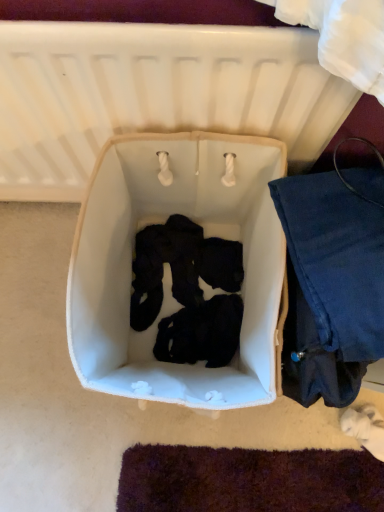
Question: Is white fabric infant bed at center located outside denim fabric pants at right?

Choices:
 (A) yes
 (B) no

Answer: (A)

Question: Is white fabric infant bed at center shorter than denim fabric pants at right?

Choices:
 (A) no
 (B) yes

Answer: (A)

Question: From a real-world perspective, is white fabric infant bed at center on denim fabric pants at right?

Choices:
 (A) yes
 (B) no

Answer: (A)

Question: Is white fabric infant bed at center to the right of denim fabric pants at right from the viewer's perspective?

Choices:
 (A) yes
 (B) no

Answer: (B)

Question: Can denim fabric pants at right be found inside white fabric infant bed at center?

Choices:
 (A) yes
 (B) no

Answer: (B)

Question: Relative to denim fabric pants at right, is white fabric infant bed at center in front or behind?

Choices:
 (A) front
 (B) behind

Answer: (A)

Question: Considering the positions of white fabric infant bed at center and denim fabric pants at right in the image, is white fabric infant bed at center wider or thinner than denim fabric pants at right?

Choices:
 (A) wide
 (B) thin

Answer: (B)

Question: In terms of size, does white fabric infant bed at center appear bigger or smaller than denim fabric pants at right?

Choices:
 (A) small
 (B) big

Answer: (A)

Question: Does point (44, 129) appear closer or farther from the camera than point (329, 230)?

Choices:
 (A) closer
 (B) farther

Answer: (B)

Question: In the image, is white fabric laundry basket at center positioned in front of or behind denim fabric pants at right?

Choices:
 (A) front
 (B) behind

Answer: (B)

Question: Considering the positions of white fabric laundry basket at center and denim fabric pants at right in the image, is white fabric laundry basket at center wider or thinner than denim fabric pants at right?

Choices:
 (A) wide
 (B) thin

Answer: (A)

Question: From the image's perspective, is white fabric laundry basket at center above or below denim fabric pants at right?

Choices:
 (A) below
 (B) above

Answer: (B)

Question: In terms of height, does white fabric laundry basket at center look taller or shorter compared to denim fabric pants at right?

Choices:
 (A) tall
 (B) short

Answer: (B)

Question: Choose the correct answer: Is white fabric laundry basket at center inside white fabric infant bed at center or outside it?

Choices:
 (A) outside
 (B) inside

Answer: (A)

Question: Is white fabric laundry basket at center in front of or behind white fabric infant bed at center in the image?

Choices:
 (A) behind
 (B) front

Answer: (A)